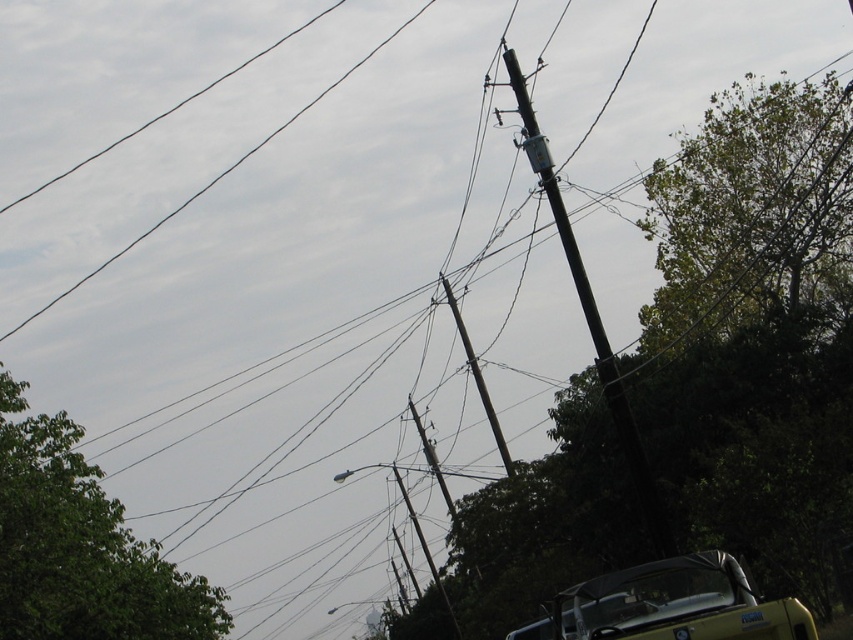
Who is more forward, [457,592] or [521,140]?

Point [521,140]

Can you confirm if green leafy tree at upper right is wider than black metallic pole at upper center?

Yes.

Is point (735, 544) farther from viewer compared to point (577, 273)?

Yes.

You are a GUI agent. You are given a task and a screenshot of the screen. Output one action in this format:
    pyautogui.click(x=<x>, y=<y>)
    Task: Click on the green leafy tree at upper right
    
    Given the screenshot: What is the action you would take?
    pyautogui.click(x=753, y=333)

Which of these two, green leafy tree at upper right or green leafy tree at lower left, stands shorter?

green leafy tree at lower left

Who is higher up, green leafy tree at upper right or green leafy tree at lower left?

green leafy tree at upper right is above.

From the picture: Who is more distant from viewer, [776,144] or [96,467]?

Positioned behind is point [776,144].

You are a GUI agent. You are given a task and a screenshot of the screen. Output one action in this format:
    pyautogui.click(x=<x>, y=<y>)
    Task: Click on the green leafy tree at upper right
    This screenshot has width=853, height=640.
    Given the screenshot: What is the action you would take?
    pyautogui.click(x=753, y=333)

Can you confirm if green leafy tree at upper right is taller than yellow matte convertible at lower right?

Yes, green leafy tree at upper right is taller than yellow matte convertible at lower right.

Is green leafy tree at upper right to the left of yellow matte convertible at lower right from the viewer's perspective?

No, green leafy tree at upper right is not to the left of yellow matte convertible at lower right.

The height and width of the screenshot is (640, 853). What do you see at coordinates (753, 333) in the screenshot?
I see `green leafy tree at upper right` at bounding box center [753, 333].

Locate an element on the screen. This screenshot has width=853, height=640. green leafy tree at upper right is located at coordinates (753, 333).